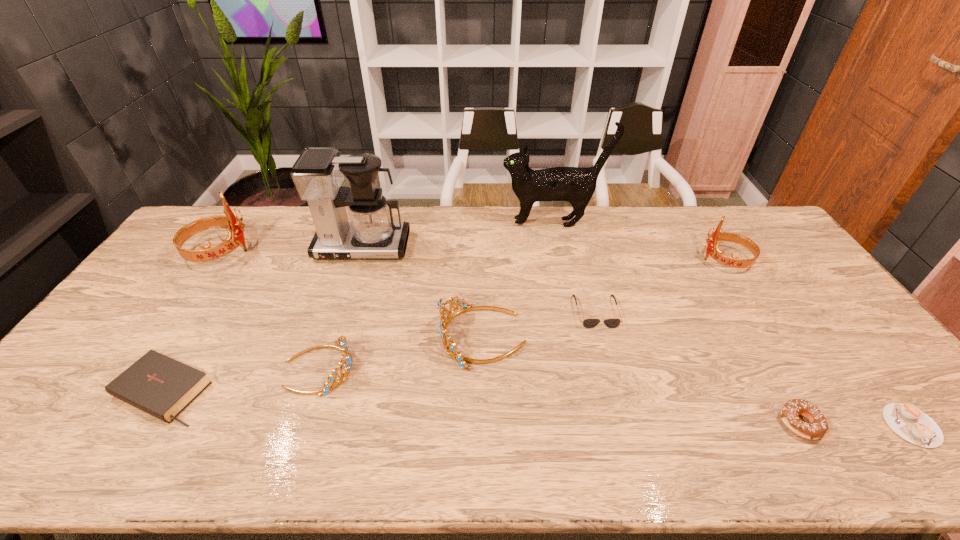
Find the location of a particular element. This screenshot has height=540, width=960. cat is located at coordinates (576, 185).

Where is `black cat`? black cat is located at coordinates (576, 185).

This screenshot has width=960, height=540. Find the location of `coffee maker`. coffee maker is located at coordinates (318, 173).

I want to click on the leftmost tiara, so click(x=235, y=237).

Find the location of `the bigger red tiara`. the bigger red tiara is located at coordinates (235, 237).

Locate an element on the screen. The image size is (960, 540). the rightmost tiara is located at coordinates click(712, 249).

Locate an element on the screen. the second tallest tiara is located at coordinates (712, 249).

Identify the location of the third tiara from left to right. (450, 347).

At what (x,y) coordinates should I click in order to perform the action: click on the bigger gold tiara. Please return your answer as a coordinate pair (x, y). This screenshot has height=540, width=960. Looking at the image, I should click on (450, 347).

Where is `the fifth shortest object`? The image size is (960, 540). the fifth shortest object is located at coordinates (346, 363).